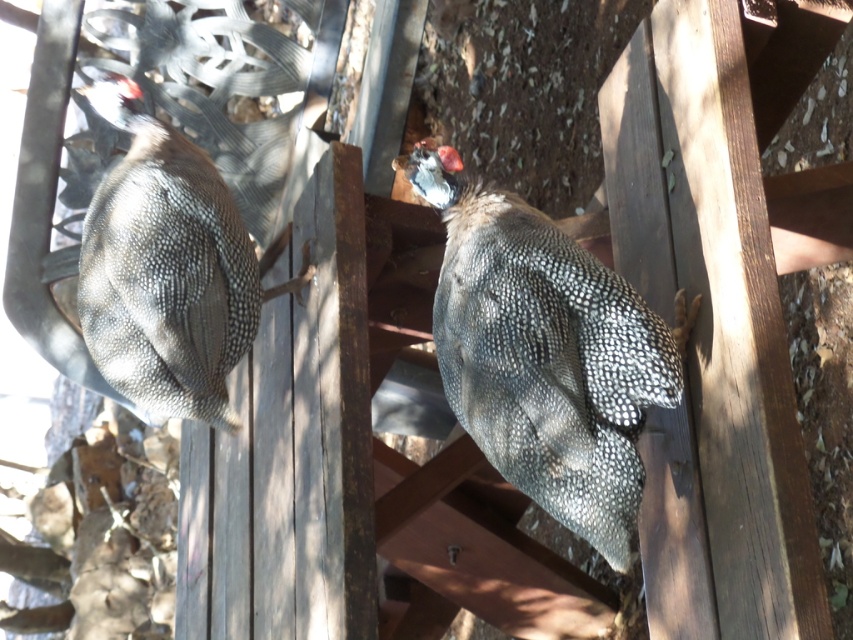
Does point (538, 410) come behind point (186, 216)?

No, (538, 410) is in front of (186, 216).

Does pearlized feathered chicken at center appear over speckled feathered chicken at left?

No.

Describe the element at coordinates (544, 353) in the screenshot. This screenshot has width=853, height=640. I see `pearlized feathered chicken at center` at that location.

Locate an element on the screen. pearlized feathered chicken at center is located at coordinates (544, 353).